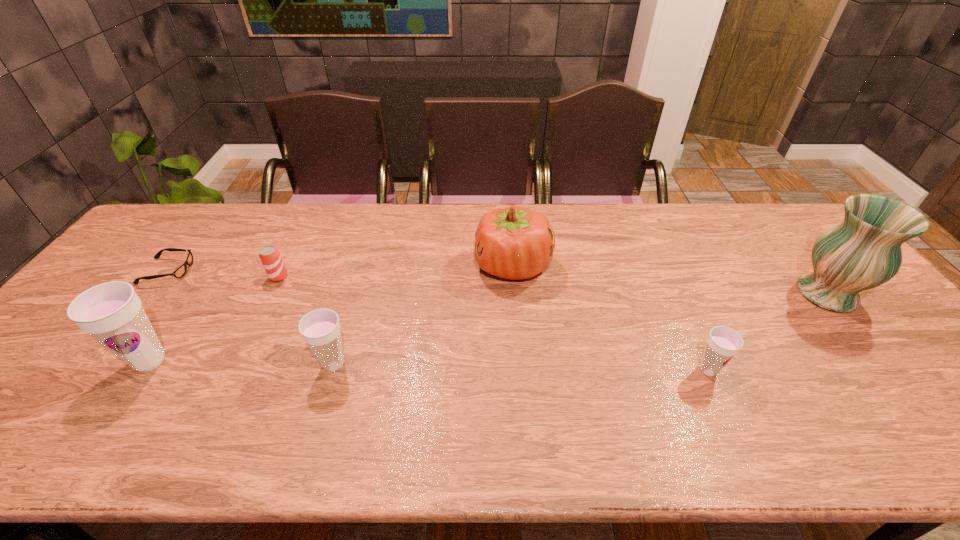
If the aim is uniform spacing by inserting an additional cup among them, please point to a vacant space for this new cup. Please provide its 2D coordinates. Your answer should be formatted as a tuple, i.e. [(x, y)], where the tuple contains the x and y coordinates of a point satisfying the conditions above.

[(519, 367)]